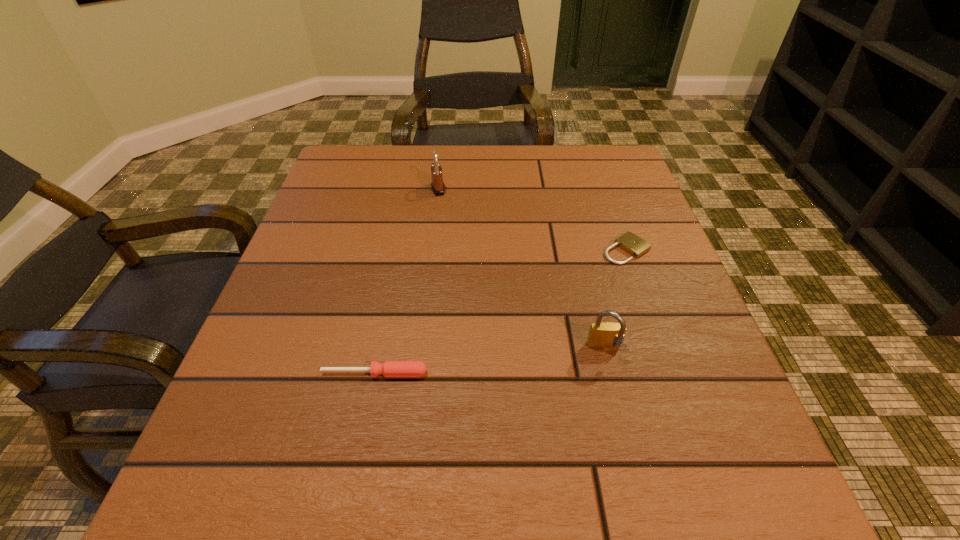
Locate an element on the screen. object that is the third closest one to the shortest object is located at coordinates (389, 368).

Identify which object is located as the second nearest to the shortest object. Please provide its 2D coordinates. Your answer should be formatted as a tuple, i.e. [(x, y)], where the tuple contains the x and y coordinates of a point satisfying the conditions above.

[(437, 185)]

The height and width of the screenshot is (540, 960). In order to click on padlock identified as the second closest to the farthest object in this screenshot , I will do `click(607, 335)`.

Choose which padlock is the nearest neighbor to the second padlock from left to right. Please provide its 2D coordinates. Your answer should be formatted as a tuple, i.e. [(x, y)], where the tuple contains the x and y coordinates of a point satisfying the conditions above.

[(632, 244)]

This screenshot has height=540, width=960. Find the location of `vacant space that satisfies the following two spatial constraints: 1. on the back side of the third tallest object; 2. on the right side of the leftmost padlock`. vacant space that satisfies the following two spatial constraints: 1. on the back side of the third tallest object; 2. on the right side of the leftmost padlock is located at coordinates (411, 189).

I want to click on free space that satisfies the following two spatial constraints: 1. on the front side of the shortest padlock; 2. on the left side of the leftmost padlock, so click(431, 250).